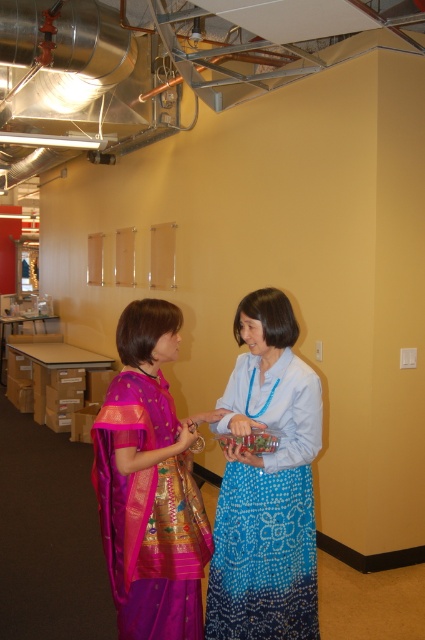
Is blue beaded skirt at center below purple silk saree at center?

Incorrect, blue beaded skirt at center is not positioned below purple silk saree at center.

Can you confirm if blue beaded skirt at center is taller than purple silk saree at center?

Correct, blue beaded skirt at center is much taller as purple silk saree at center.

Describe the element at coordinates (266, 484) in the screenshot. Image resolution: width=425 pixels, height=640 pixels. I see `blue beaded skirt at center` at that location.

Find the location of a particular element. The height and width of the screenshot is (640, 425). blue beaded skirt at center is located at coordinates (266, 484).